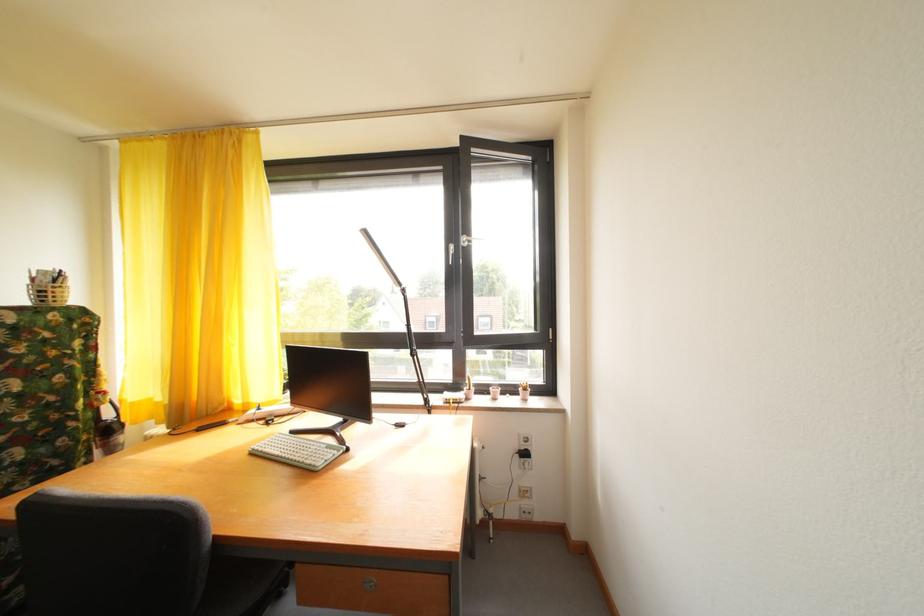
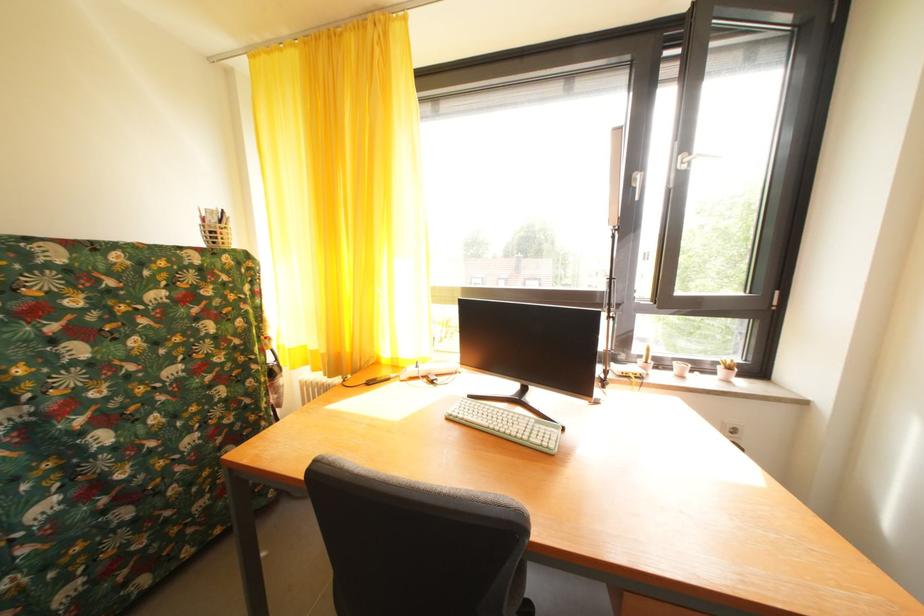
Locate, in the second image, the point that corresponds to point (301, 438) in the first image.

(479, 402)